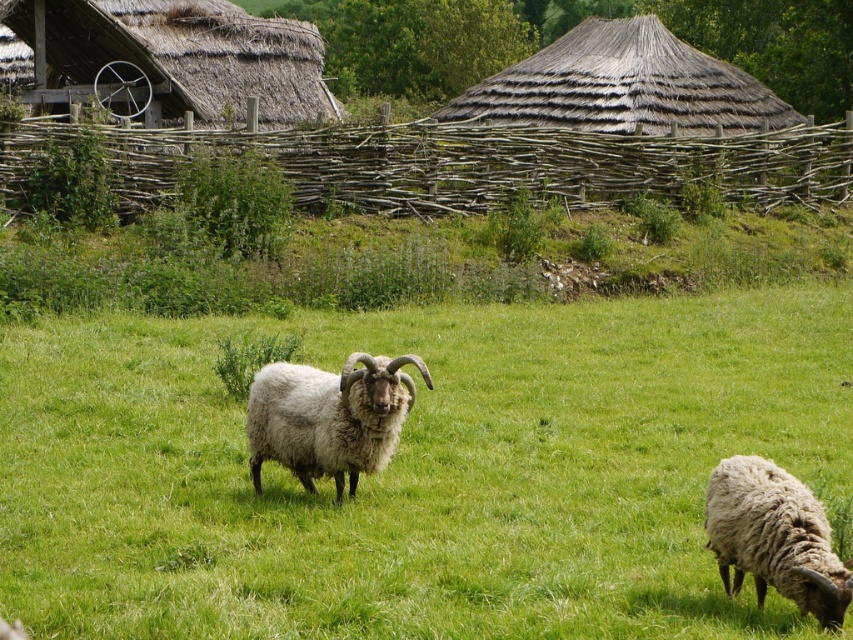
You are a visitor in this pastoral scene and want to take a photo of both the thatched straw hut at upper left and the white woolly sheep at lower right. Which object should you focus on first if you want to capture both in a single frame without moving your camera?

The thatched straw hut at upper left is positioned on the left side of white woolly sheep at lower right, so you should focus on the thatched straw hut at upper left first to ensure both are in frame.